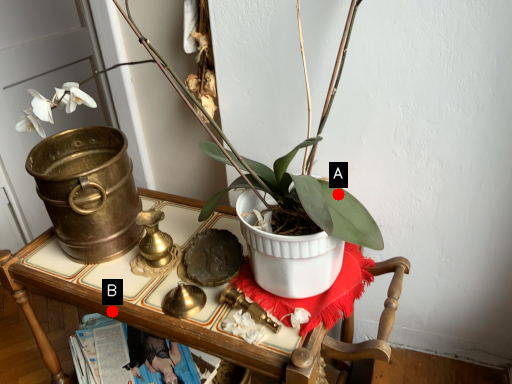
Question: Two points are circled on the image, labeled by A and B beside each circle. Among these points, which one is farthest from the camera?

Choices:
 (A) A is further
 (B) B is further

Answer: (B)